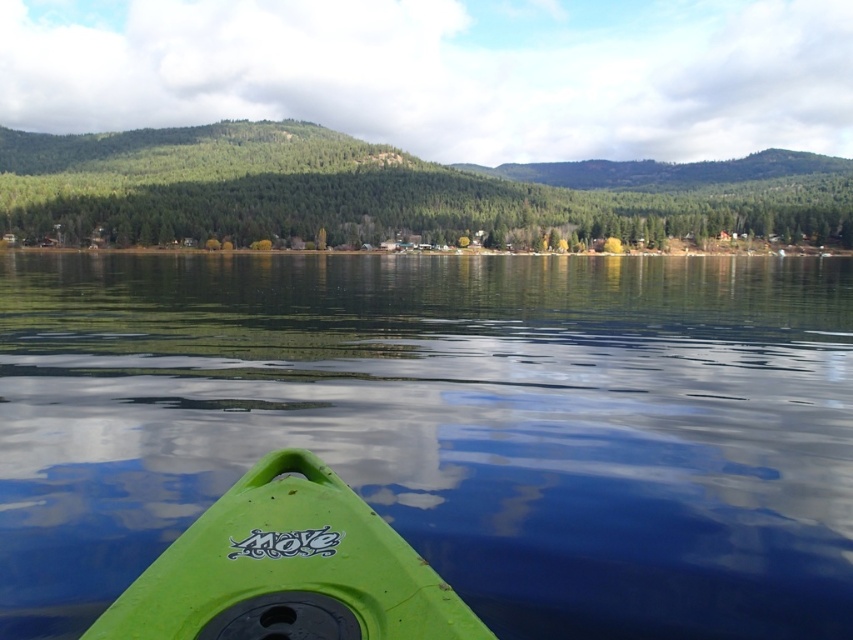
Question: Observing the image, what is the correct spatial positioning of green forested mountain at upper center in reference to green matte kayak at lower center?

Choices:
 (A) left
 (B) right

Answer: (B)

Question: Which object is positioned closest to the transparent water at center?

Choices:
 (A) green forested mountain at upper center
 (B) green matte kayak at lower center

Answer: (B)

Question: Which of the following is the closest to the observer?

Choices:
 (A) green matte kayak at lower center
 (B) transparent water at center
 (C) green forested mountain at upper center

Answer: (A)

Question: Is transparent water at center closer to the viewer compared to green matte kayak at lower center?

Choices:
 (A) no
 (B) yes

Answer: (A)

Question: Can you confirm if green forested mountain at upper center is positioned to the left of green matte kayak at lower center?

Choices:
 (A) no
 (B) yes

Answer: (A)

Question: Among these objects, which one is farthest from the camera?

Choices:
 (A) transparent water at center
 (B) green matte kayak at lower center

Answer: (A)